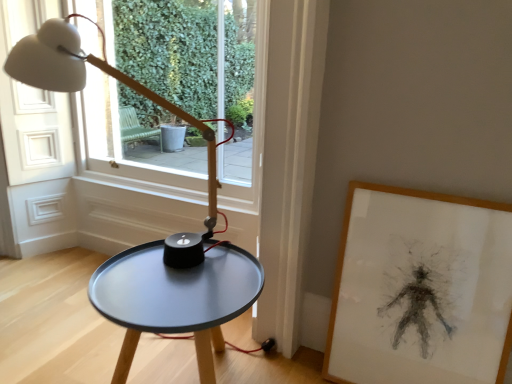
Question: From the image's perspective, is wooden framed drawing at right located above transparent glass window at upper center?

Choices:
 (A) no
 (B) yes

Answer: (A)

Question: Is wooden framed drawing at right thinner than transparent glass window at upper center?

Choices:
 (A) yes
 (B) no

Answer: (A)

Question: From the image's perspective, would you say wooden framed drawing at right is shown under transparent glass window at upper center?

Choices:
 (A) no
 (B) yes

Answer: (B)

Question: Is wooden framed drawing at right wider than transparent glass window at upper center?

Choices:
 (A) no
 (B) yes

Answer: (A)

Question: From a real-world perspective, is wooden framed drawing at right on transparent glass window at upper center?

Choices:
 (A) no
 (B) yes

Answer: (A)

Question: From a real-world perspective, relative to matte black table at center, is wooden framed drawing at right vertically above or below?

Choices:
 (A) below
 (B) above

Answer: (B)

Question: Is wooden framed drawing at right wider or thinner than matte black table at center?

Choices:
 (A) wide
 (B) thin

Answer: (B)

Question: Choose the correct answer: Is wooden framed drawing at right inside matte black table at center or outside it?

Choices:
 (A) inside
 (B) outside

Answer: (B)

Question: From their relative heights in the image, would you say wooden framed drawing at right is taller or shorter than matte black table at center?

Choices:
 (A) tall
 (B) short

Answer: (A)

Question: From a real-world perspective, is transparent glass window at upper center positioned above or below matte black table at center?

Choices:
 (A) below
 (B) above

Answer: (B)

Question: From the image's perspective, is transparent glass window at upper center located above or below matte black table at center?

Choices:
 (A) below
 (B) above

Answer: (B)

Question: Relative to matte black table at center, is transparent glass window at upper center in front or behind?

Choices:
 (A) front
 (B) behind

Answer: (B)

Question: Based on their sizes in the image, would you say transparent glass window at upper center is bigger or smaller than matte black table at center?

Choices:
 (A) small
 (B) big

Answer: (B)

Question: Is matte black table at center bigger or smaller than wooden framed drawing at right?

Choices:
 (A) small
 (B) big

Answer: (B)

Question: Is matte black table at center in front of or behind wooden framed drawing at right in the image?

Choices:
 (A) front
 (B) behind

Answer: (A)